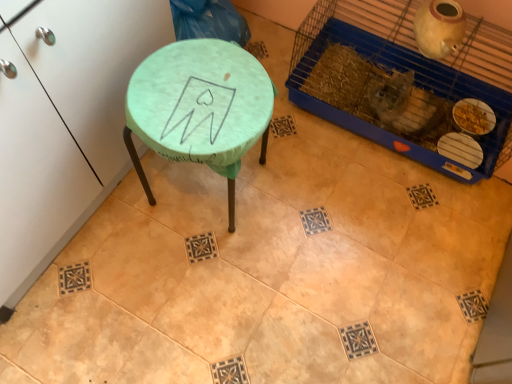
In order to click on vacant space in front of blue plastic bird cage at upper right in this screenshot , I will do `click(375, 236)`.